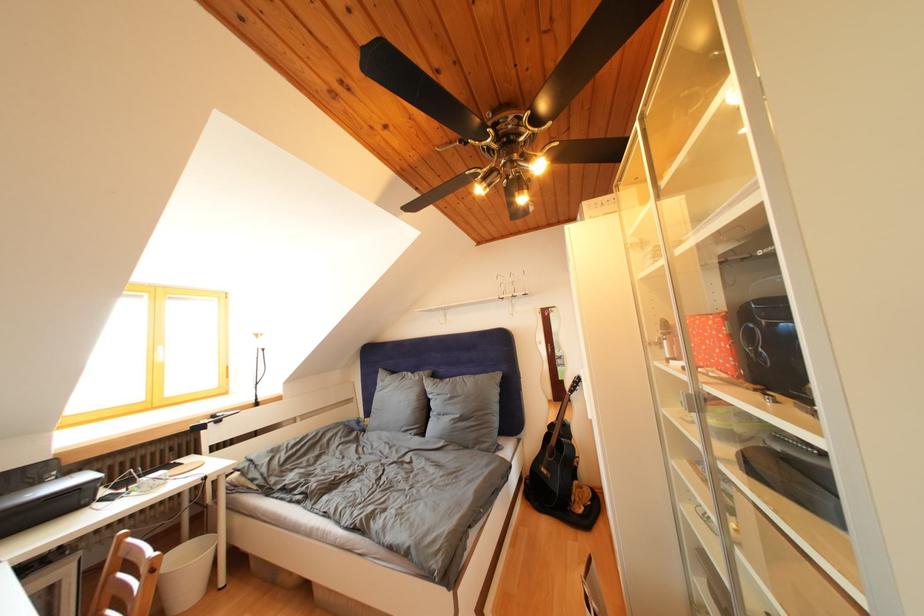
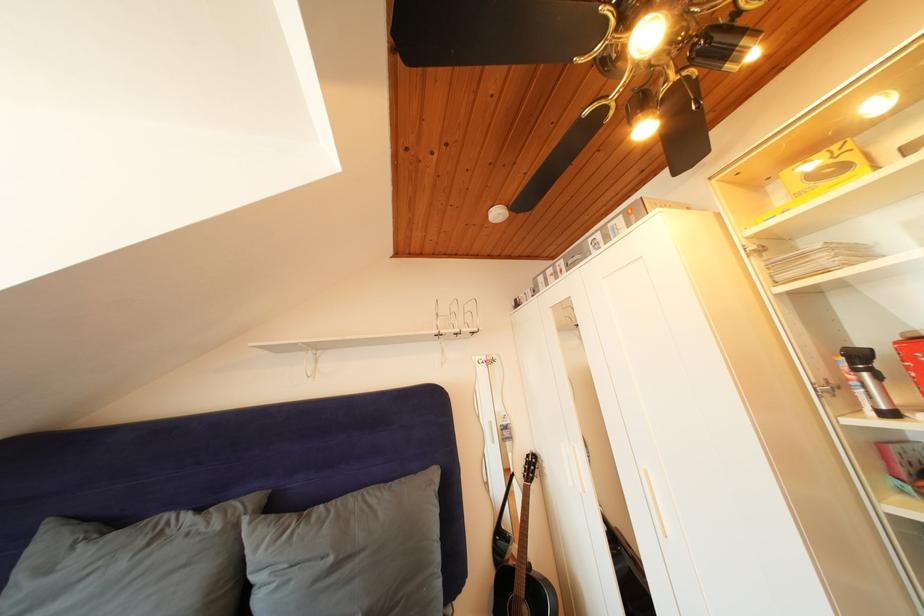
Locate, in the second image, the point that corresponds to (x=457, y=400) in the first image.

(338, 565)